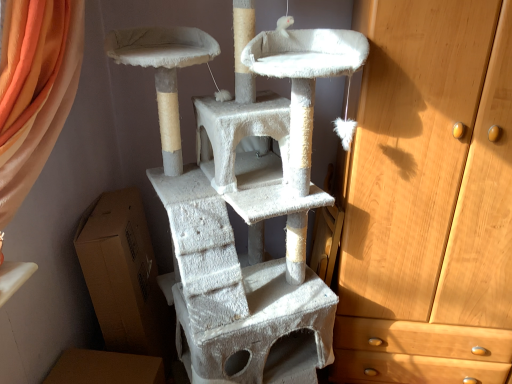
Identify the location of white textured cat tree at center. (243, 202).

Locate an element on the screen. The image size is (512, 384). light brown wooden chest of drawers at right is located at coordinates (429, 198).

The width and height of the screenshot is (512, 384). I want to click on brown cardboard box at lower left, so click(124, 275).

The image size is (512, 384). In order to click on white textured cat tree at center in this screenshot , I will do `click(243, 202)`.

Looking at this image, considering the sizes of objects brown cardboard box at lower left and light brown wooden chest of drawers at right in the image provided, who is wider, brown cardboard box at lower left or light brown wooden chest of drawers at right?

light brown wooden chest of drawers at right.

Would you say light brown wooden chest of drawers at right is part of brown cardboard box at lower left's contents?

Actually, light brown wooden chest of drawers at right is outside brown cardboard box at lower left.

Based on the photo, in terms of height, does brown cardboard box at lower left look taller or shorter compared to light brown wooden chest of drawers at right?

brown cardboard box at lower left is shorter than light brown wooden chest of drawers at right.

Considering the sizes of brown cardboard box at lower left and light brown wooden chest of drawers at right in the image, is brown cardboard box at lower left bigger or smaller than light brown wooden chest of drawers at right?

Clearly, brown cardboard box at lower left is smaller in size than light brown wooden chest of drawers at right.

Does point (284, 17) come in front of point (153, 312)?

Yes, point (284, 17) is closer to viewer.

Considering the relative sizes of white textured cat tree at center and brown cardboard box at lower left in the image provided, is white textured cat tree at center wider than brown cardboard box at lower left?

Indeed, white textured cat tree at center has a greater width compared to brown cardboard box at lower left.

Would you say white textured cat tree at center is outside brown cardboard box at lower left?

Yes.

This screenshot has width=512, height=384. Identify the location of bunk bed that appears above the brown cardboard box at lower left (from the image's perspective). (243, 202).

Between brown cardboard box at lower left and white textured cat tree at center, which one has less height?

brown cardboard box at lower left.

Consider the image. How many degrees apart are the facing directions of brown cardboard box at lower left and white textured cat tree at center?

59 degrees separate the facing orientations of brown cardboard box at lower left and white textured cat tree at center.

How much distance is there between brown cardboard box at lower left and white textured cat tree at center?

brown cardboard box at lower left and white textured cat tree at center are 16.99 inches apart.

Identify the location of bunk bed on the right of the brown cardboard box at lower left. (243, 202).

Are white textured cat tree at center and light brown wooden chest of drawers at right making contact?

No, white textured cat tree at center is not making contact with light brown wooden chest of drawers at right.

Is white textured cat tree at center to the right of light brown wooden chest of drawers at right from the viewer's perspective?

No, white textured cat tree at center is not to the right of light brown wooden chest of drawers at right.

Which is in front, white textured cat tree at center or light brown wooden chest of drawers at right?

white textured cat tree at center.

Is white textured cat tree at center oriented away from light brown wooden chest of drawers at right?

No, white textured cat tree at center's orientation is not away from light brown wooden chest of drawers at right.

Find the location of a particular element. cardboard box on the left of the light brown wooden chest of drawers at right is located at coordinates (124, 275).

Considering the sizes of light brown wooden chest of drawers at right and brown cardboard box at lower left in the image, is light brown wooden chest of drawers at right bigger or smaller than brown cardboard box at lower left?

In the image, light brown wooden chest of drawers at right appears to be larger than brown cardboard box at lower left.

From the image's perspective, which is above, light brown wooden chest of drawers at right or brown cardboard box at lower left?

light brown wooden chest of drawers at right appears higher in the image.

Is the position of light brown wooden chest of drawers at right less distant than that of white textured cat tree at center?

No.

Is light brown wooden chest of drawers at right situated inside white textured cat tree at center or outside?

The correct answer is: outside.

Can you tell me how much light brown wooden chest of drawers at right and white textured cat tree at center differ in facing direction?

The facing directions of light brown wooden chest of drawers at right and white textured cat tree at center are 30.5 degrees apart.

Looking at this image, would you say light brown wooden chest of drawers at right is a long distance from white textured cat tree at center?

No, light brown wooden chest of drawers at right is in close proximity to white textured cat tree at center.

Locate an element on the screen. chest of drawers on the right of brown cardboard box at lower left is located at coordinates (429, 198).

The image size is (512, 384). I want to click on cardboard box to the left of white textured cat tree at center, so click(124, 275).

Based on their spatial positions, is brown cardboard box at lower left or white textured cat tree at center closer to light brown wooden chest of drawers at right?

Among the two, white textured cat tree at center is located nearer to light brown wooden chest of drawers at right.

From the image, which object appears to be farther from brown cardboard box at lower left, light brown wooden chest of drawers at right or white textured cat tree at center?

light brown wooden chest of drawers at right is positioned further to the anchor brown cardboard box at lower left.

Based on their spatial positions, is light brown wooden chest of drawers at right or brown cardboard box at lower left closer to white textured cat tree at center?

Among the two, light brown wooden chest of drawers at right is located nearer to white textured cat tree at center.

Based on their spatial positions, is white textured cat tree at center or light brown wooden chest of drawers at right further from brown cardboard box at lower left?

light brown wooden chest of drawers at right.

Which object lies further to the anchor point light brown wooden chest of drawers at right, white textured cat tree at center or brown cardboard box at lower left?

brown cardboard box at lower left.

Based on their spatial positions, is brown cardboard box at lower left or light brown wooden chest of drawers at right closer to white textured cat tree at center?

light brown wooden chest of drawers at right lies closer to white textured cat tree at center than the other object.

The image size is (512, 384). I want to click on bunk bed located between brown cardboard box at lower left and light brown wooden chest of drawers at right in the left-right direction, so click(x=243, y=202).